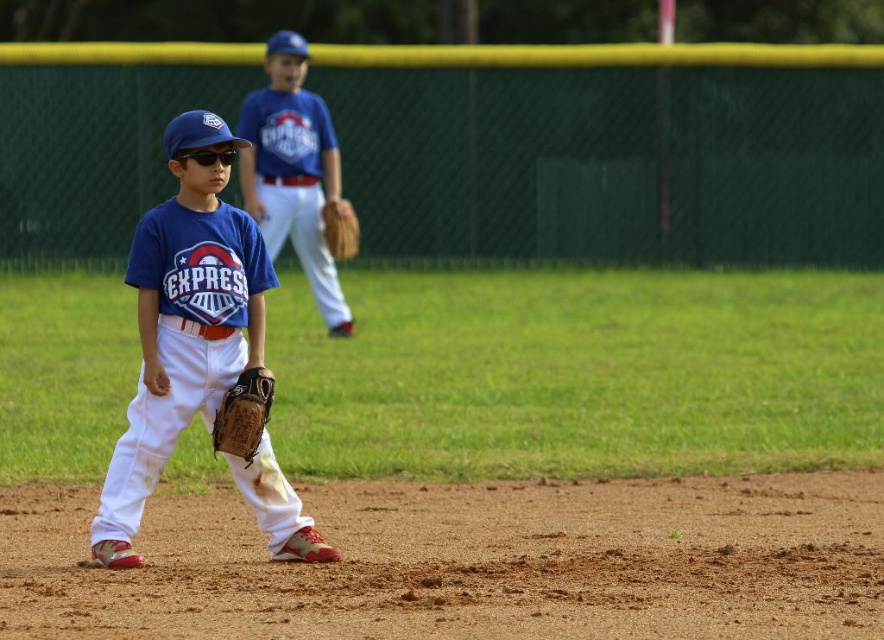
You are a coach standing at the edge of the infield and want to retrieve both the matte blue jersey at center and the brown leather glove at center for a quick equipment check. Given that you can only carry one item at a time, which item should you pick up first if you want to minimize the total distance you walk?

You should pick up the matte blue jersey at center first because it is closer to you at 20.47 feet away from the brown leather glove at center, so retrieving it first would reduce the backtracking distance.

You are a photographer at the baseball game. You want to take a photo of the blue jersey at center and the brown leather glove at center. Which object should you zoom in on to capture more detail without moving the camera?

The blue jersey at center is larger in size than the brown leather glove at center, so you should zoom in on the brown leather glove at center to capture more detail since it is smaller and requires closer focus.